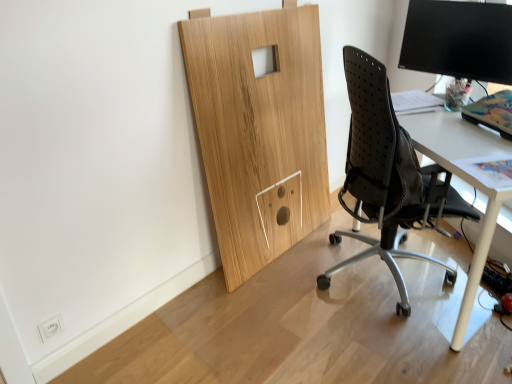
In order to click on free spot to the left of white glossy desk at right in this screenshot , I will do `click(286, 304)`.